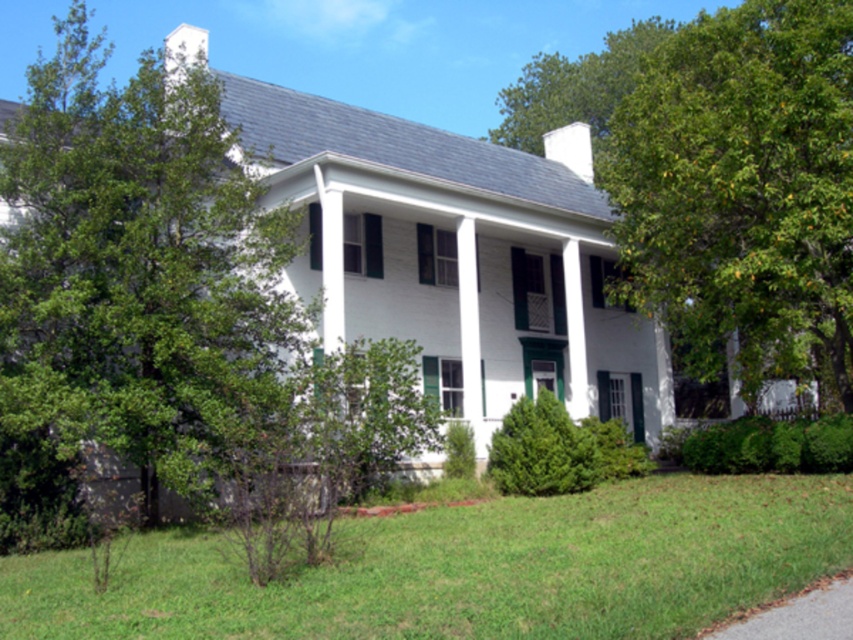
From the picture: How much distance is there between green leafy tree at left and green leafy tree at right?

A distance of 10.65 meters exists between green leafy tree at left and green leafy tree at right.

In the scene shown: Is green leafy tree at left wider than green leafy tree at right?

Indeed, green leafy tree at left has a greater width compared to green leafy tree at right.

You are a GUI agent. You are given a task and a screenshot of the screen. Output one action in this format:
    pyautogui.click(x=<x>, y=<y>)
    Task: Click on the green leafy tree at left
    
    Given the screenshot: What is the action you would take?
    pyautogui.click(x=132, y=264)

Does green leafy tree at left have a larger size compared to green grass at lower center?

Indeed, green leafy tree at left has a larger size compared to green grass at lower center.

Which is in front, point (57, 296) or point (496, 611)?

Point (496, 611)

Where is `green leafy tree at left`? This screenshot has height=640, width=853. green leafy tree at left is located at coordinates (132, 264).

Is green grass at lower center shorter than green leafy tree at right?

Yes.

Can you confirm if green grass at lower center is positioned to the left of green leafy tree at right?

Yes, green grass at lower center is to the left of green leafy tree at right.

The width and height of the screenshot is (853, 640). I want to click on green grass at lower center, so click(469, 568).